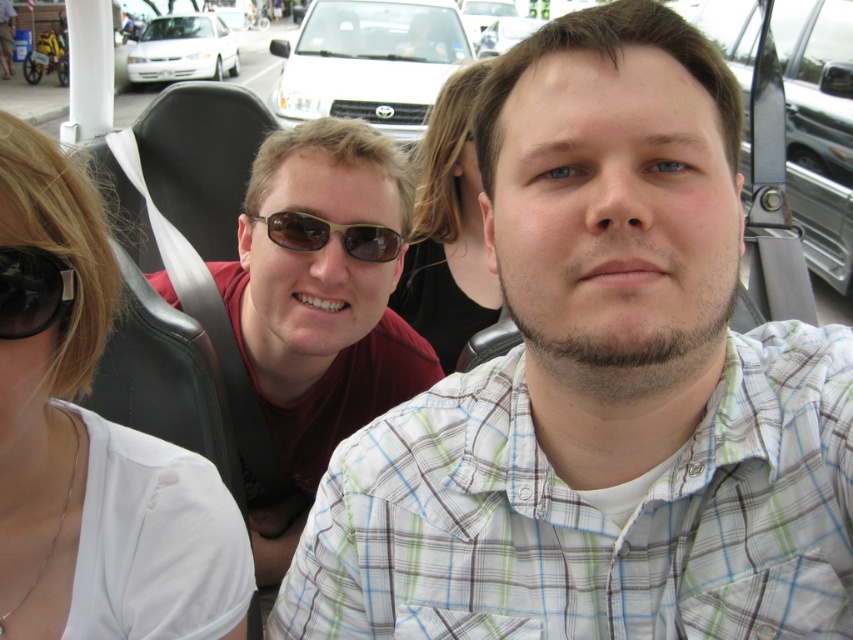
You are a photographer taking a picture of the scene. You notice the smooth black hair at center and the white glossy sedan at upper left. Which object is positioned to the right of the other?

The smooth black hair at center is to the right of the white glossy sedan at upper left.

You are a photographer trying to capture a photo of the smooth black hair at center in the vehicle. The camera is set to focus at point 0.35, 0.52. Will the focus be accurate?

The smooth black hair at center is at point (x=447, y=228), which is very close to the camera focus point of (x=443, y=224). The focus should be accurate enough for a clear photo.